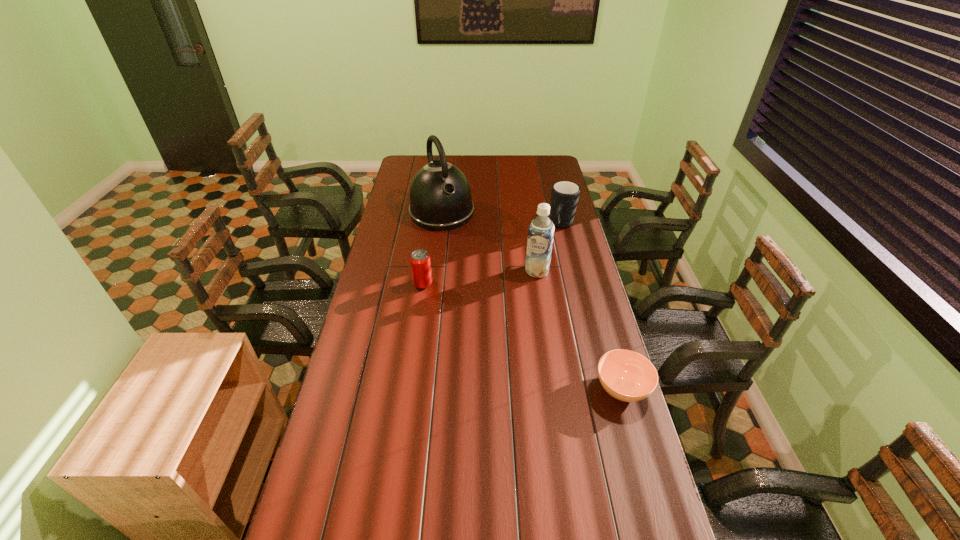
I want to click on free point located on the label of the second tallest object, so click(520, 316).

Locate an element on the screen. vacant space located 0.330m on the label of the second tallest object is located at coordinates (513, 337).

The image size is (960, 540). Find the location of `vacant space located 0.300m on the side of the mug with the handle`. vacant space located 0.300m on the side of the mug with the handle is located at coordinates click(539, 275).

Find the location of `free space located on the side of the mug with the handle`. free space located on the side of the mug with the handle is located at coordinates (556, 242).

This screenshot has height=540, width=960. In order to click on free spot located 0.290m on the side of the mug with the handle in this screenshot , I will do `click(540, 274)`.

Find the location of `vacant area situated on the spout of the kettle`. vacant area situated on the spout of the kettle is located at coordinates (459, 244).

Identify the location of vacant space located on the spout of the kettle. (475, 272).

The height and width of the screenshot is (540, 960). Find the location of `vacant space located 0.050m on the spout of the kettle`. vacant space located 0.050m on the spout of the kettle is located at coordinates (455, 238).

You are a GUI agent. You are given a task and a screenshot of the screen. Output one action in this format:
    pyautogui.click(x=<x>, y=<y>)
    Task: Click on the object that is positioned at the left edge
    
    Given the screenshot: What is the action you would take?
    pyautogui.click(x=440, y=196)

Find the location of a particular element. soup bowl situated at the right edge is located at coordinates (627, 376).